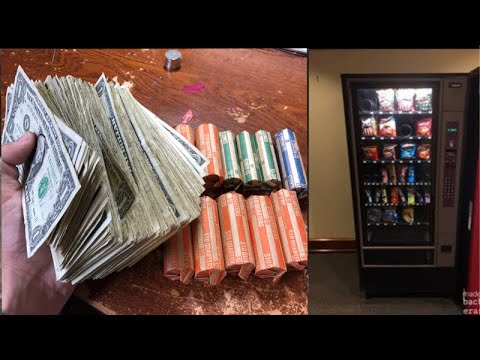
The width and height of the screenshot is (480, 360). I want to click on wall, so click(325, 114).